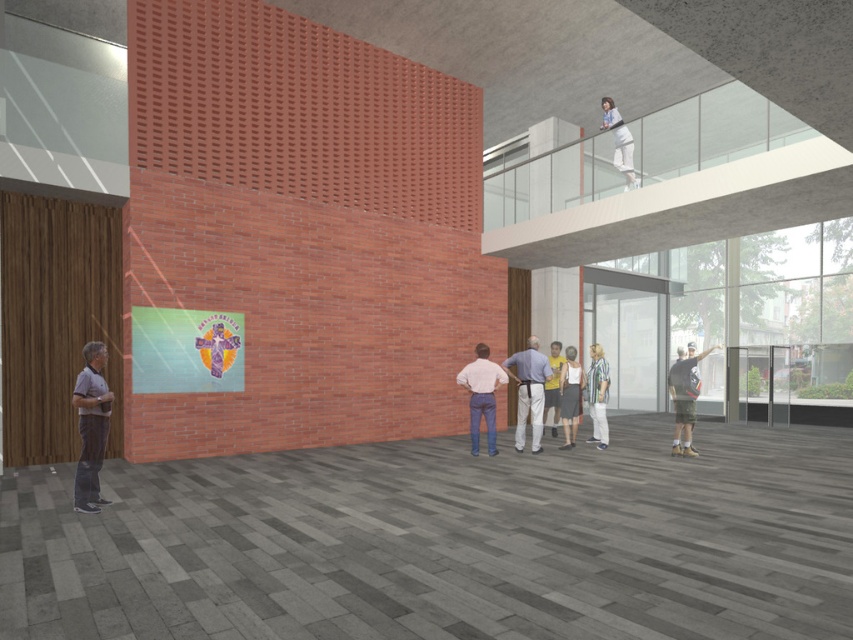
Can you confirm if gray cotton shirt at left is positioned to the left of matte pink shirt at center?

Correct, you'll find gray cotton shirt at left to the left of matte pink shirt at center.

The height and width of the screenshot is (640, 853). What are the coordinates of `gray cotton shirt at left` in the screenshot? It's located at (91, 426).

Who is more distant from viewer, (90, 465) or (459, 372)?

The point (459, 372) is more distant.

Locate an element on the screen. The height and width of the screenshot is (640, 853). gray cotton shirt at left is located at coordinates (91, 426).

Is matte pink shirt at center bigger than yellow t-shirt at center?

Incorrect, matte pink shirt at center is not larger than yellow t-shirt at center.

Where is `matte pink shirt at center`? The width and height of the screenshot is (853, 640). matte pink shirt at center is located at coordinates (480, 394).

This screenshot has height=640, width=853. Identify the location of striped cotton shirt at center. (596, 396).

Which is behind, point (599, 346) or point (550, 362)?

Positioned behind is point (550, 362).

Which is in front, point (596, 371) or point (554, 368)?

Point (596, 371) is in front.

The width and height of the screenshot is (853, 640). In order to click on striped cotton shirt at center in this screenshot , I will do `click(596, 396)`.